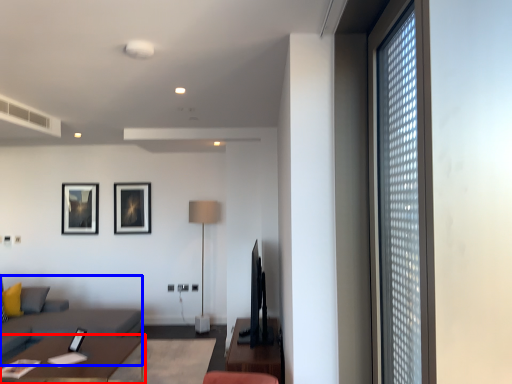
Question: Which object appears closest to the camera in this image, table (highlighted by a red box) or couch (highlighted by a blue box)?

Choices:
 (A) table
 (B) couch

Answer: (A)